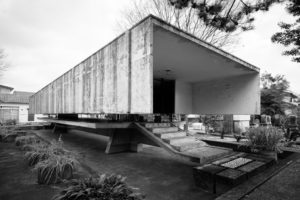
Image resolution: width=300 pixels, height=200 pixels. Identify the location of interior right wall. (224, 96).